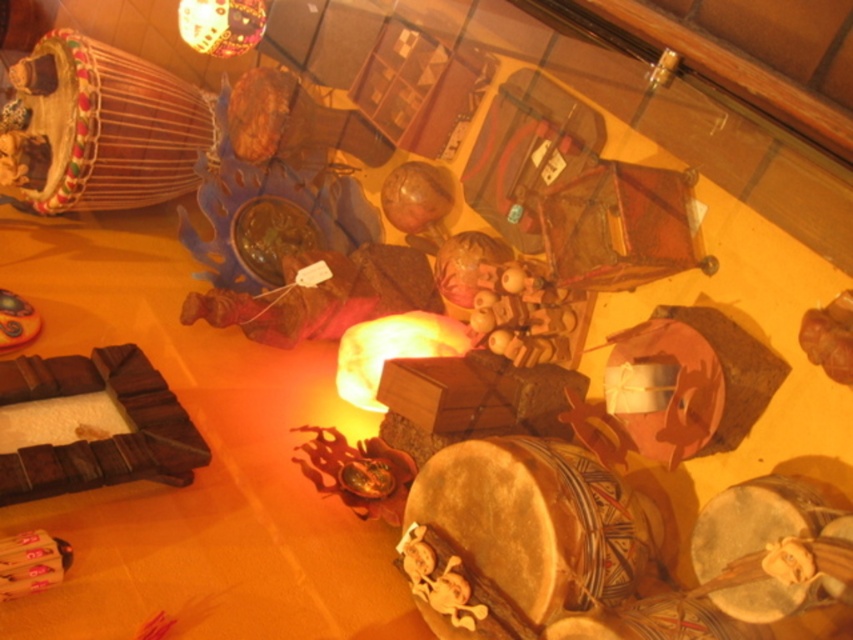
Question: Among these points, which one is nearest to the camera?

Choices:
 (A) (540, 611)
 (B) (631, 637)
 (C) (178, 140)
 (D) (750, 570)

Answer: (D)

Question: Can you confirm if natural wood drum at center is positioned to the left of multicolored wooden drum at upper left?

Choices:
 (A) no
 (B) yes

Answer: (A)

Question: Is natural wood drum at center bigger than wooden drum at lower right?

Choices:
 (A) yes
 (B) no

Answer: (A)

Question: Which is nearer to the wooden drum at lower right?

Choices:
 (A) leather drum at center
 (B) multicolored wooden drum at upper left
 (C) natural wood drum at center

Answer: (A)

Question: Which is nearer to the multicolored wooden drum at upper left?

Choices:
 (A) natural wood drum at center
 (B) leather drum at center

Answer: (A)

Question: From the image, what is the correct spatial relationship of natural wood drum at center in relation to leather drum at center?

Choices:
 (A) below
 (B) above

Answer: (A)